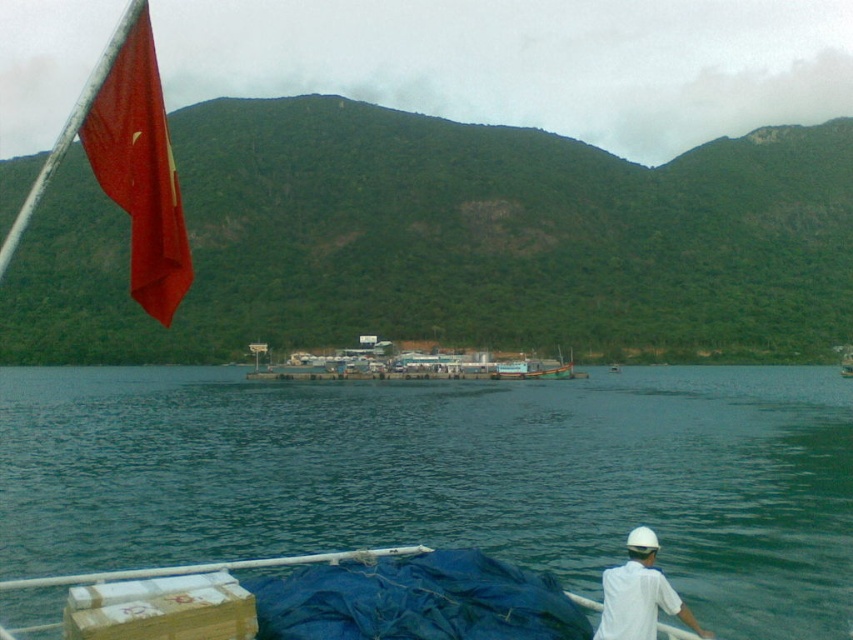
You are on a boat and need to reach the dock ahead. You see the green water at center and the white matte shirt at lower right. Which object is closer to the dock?

The green water at center is closer to the dock because it is below the white matte shirt at lower right, indicating it is positioned lower and nearer in the scene.